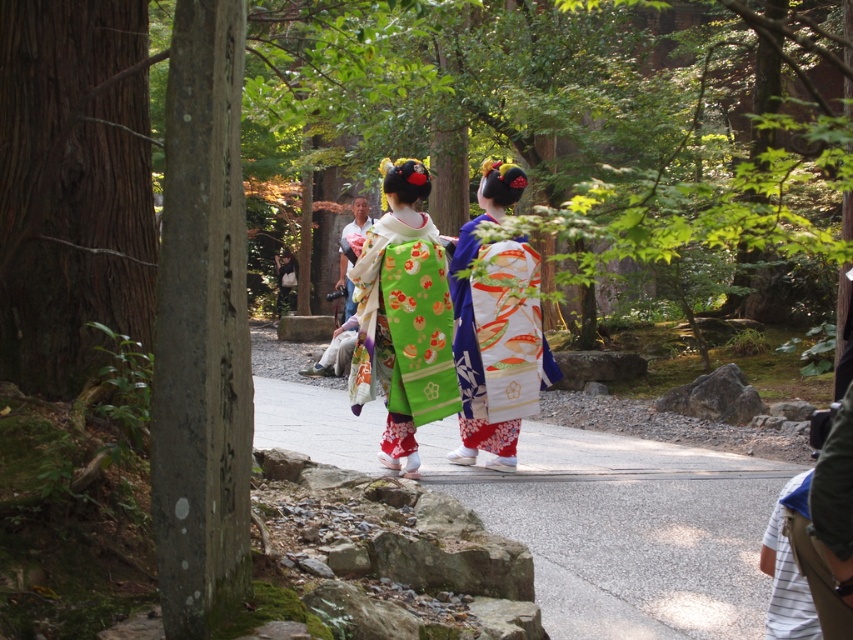
Question: Is smooth asphalt path at center to the left of white silk kimono at center from the viewer's perspective?

Choices:
 (A) no
 (B) yes

Answer: (A)

Question: Which of these objects is positioned farthest from the green silk kimono at center?

Choices:
 (A) smooth asphalt path at center
 (B) white silk kimono at center

Answer: (A)

Question: Does smooth asphalt path at center have a lesser width compared to white silk kimono at center?

Choices:
 (A) yes
 (B) no

Answer: (B)

Question: Which object appears closest to the camera in this image?

Choices:
 (A) white silk kimono at center
 (B) green silk kimono at center
 (C) smooth asphalt path at center

Answer: (C)

Question: Estimate the real-world distances between objects in this image. Which object is closer to the white silk kimono at center?

Choices:
 (A) smooth asphalt path at center
 (B) green silk kimono at center

Answer: (B)

Question: Does green silk kimono at center have a smaller size compared to white silk kimono at center?

Choices:
 (A) yes
 (B) no

Answer: (A)